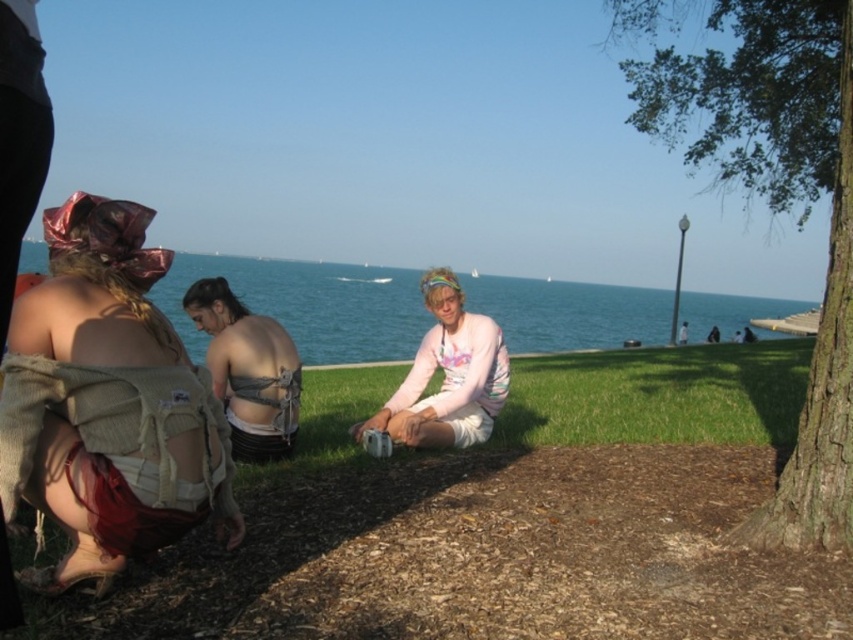
Is the position of matte beige backpack at lower left less distant than that of green grass at center?

Yes, it is.

Is matte beige backpack at lower left shorter than green grass at center?

No, matte beige backpack at lower left is not shorter than green grass at center.

What do you see at coordinates (106, 401) in the screenshot? The height and width of the screenshot is (640, 853). I see `matte beige backpack at lower left` at bounding box center [106, 401].

I want to click on matte beige backpack at lower left, so point(106,401).

Is matte beige backpack at lower left smaller than blue water at center?

Correct, matte beige backpack at lower left occupies less space than blue water at center.

Which is in front, point (183, 483) or point (323, 360)?

Point (183, 483) is in front.

Find the location of a particular element. matte beige backpack at lower left is located at coordinates (106, 401).

Does green grass at center appear over matte gray fabric at center?

No.

At what (x,y) coordinates should I click in order to perform the action: click on green grass at center. Please return your answer as a coordinate pair (x, y). This screenshot has height=640, width=853. Looking at the image, I should click on point(659,396).

Identify the location of green grass at center. Image resolution: width=853 pixels, height=640 pixels. (659, 396).

Image resolution: width=853 pixels, height=640 pixels. I want to click on green grass at center, so click(659, 396).